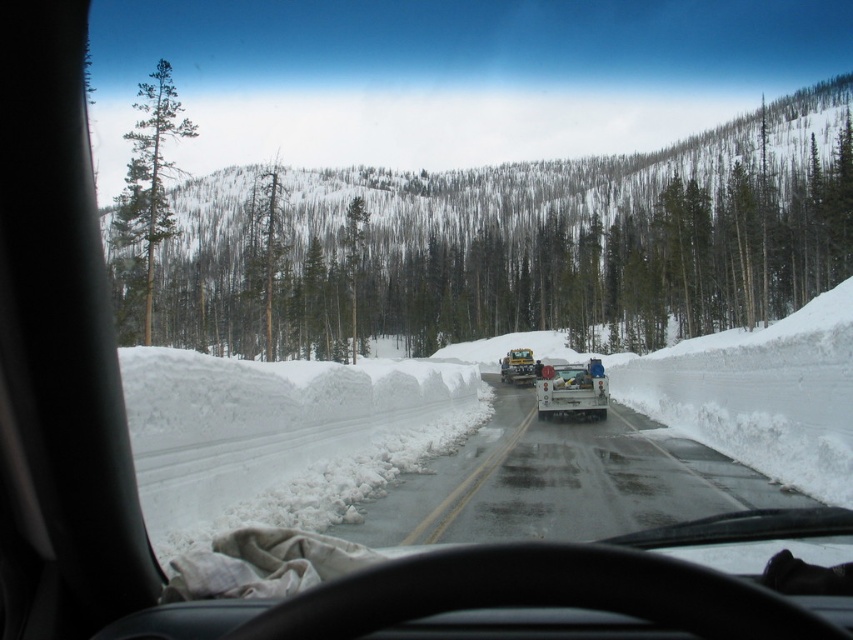
Between white glossy truck at center and white glossy trailer truck at center, which one appears on the left side from the viewer's perspective?

From the viewer's perspective, white glossy truck at center appears more on the left side.

Which is behind, point (599, 515) or point (512, 381)?

The point (512, 381) is more distant.

Does point (521, 468) come farther from viewer compared to point (503, 371)?

No, (521, 468) is in front of (503, 371).

Find the location of `white glossy truck at center`. white glossy truck at center is located at coordinates (560, 481).

Does white glossy truck at center appear over white matte trailer truck at center?

Incorrect, white glossy truck at center is not positioned above white matte trailer truck at center.

What do you see at coordinates (560, 481) in the screenshot? The image size is (853, 640). I see `white glossy truck at center` at bounding box center [560, 481].

You are a GUI agent. You are given a task and a screenshot of the screen. Output one action in this format:
    pyautogui.click(x=<x>, y=<y>)
    Task: Click on the white glossy truck at center
    
    Given the screenshot: What is the action you would take?
    pyautogui.click(x=560, y=481)

You are a GUI agent. You are given a task and a screenshot of the screen. Output one action in this format:
    pyautogui.click(x=<x>, y=<y>)
    Task: Click on the white matte trailer truck at center
    
    Given the screenshot: What is the action you would take?
    pyautogui.click(x=572, y=388)

Between white matte trailer truck at center and white glossy trailer truck at center, which one appears on the right side from the viewer's perspective?

white matte trailer truck at center is more to the right.

Where is `white matte trailer truck at center`? The width and height of the screenshot is (853, 640). white matte trailer truck at center is located at coordinates [x=572, y=388].